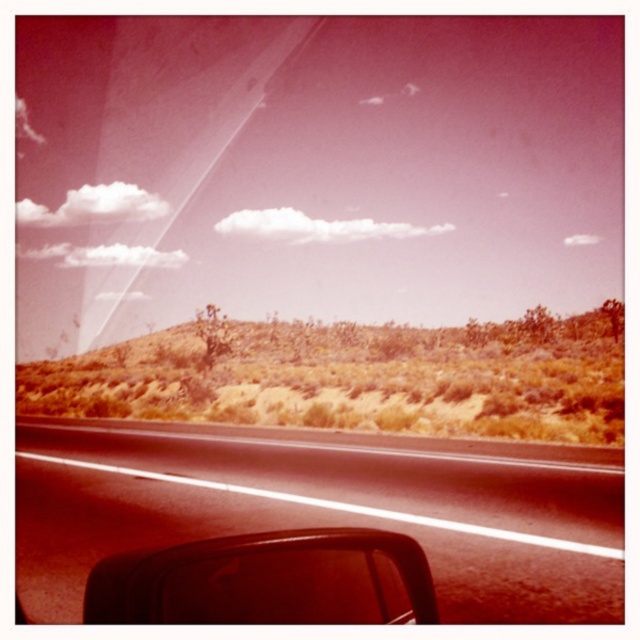
Does point (221, 468) come farther from viewer compared to point (272, 596)?

Yes, it is behind point (272, 596).

How distant is black asphalt road at center from matte black view mirror at lower left?

black asphalt road at center and matte black view mirror at lower left are 3.89 meters apart from each other.

Who is more distant from viewer, [435,465] or [161,577]?

Positioned behind is point [435,465].

You are a GUI agent. You are given a task and a screenshot of the screen. Output one action in this format:
    pyautogui.click(x=<x>, y=<y>)
    Task: Click on the black asphalt road at center
    The image size is (640, 640).
    Given the screenshot: What is the action you would take?
    pyautogui.click(x=326, y=508)

Is black asphalt road at center shorter than desertgrassy/sandyhills at lower center?

Yes.

In the scene shown: Can you confirm if black asphalt road at center is positioned to the right of desertgrassy/sandyhills at lower center?

Indeed, black asphalt road at center is positioned on the right side of desertgrassy/sandyhills at lower center.

Where is `black asphalt road at center`? The height and width of the screenshot is (640, 640). black asphalt road at center is located at coordinates (326, 508).

Image resolution: width=640 pixels, height=640 pixels. In order to click on black asphalt road at center in this screenshot , I will do `click(326, 508)`.

How distant is transparent glass car window at center from matte black view mirror at lower left?

The distance of transparent glass car window at center from matte black view mirror at lower left is 128.82 meters.

Does transparent glass car window at center have a lesser width compared to matte black view mirror at lower left?

No.

The image size is (640, 640). I want to click on transparent glass car window at center, so click(x=323, y=224).